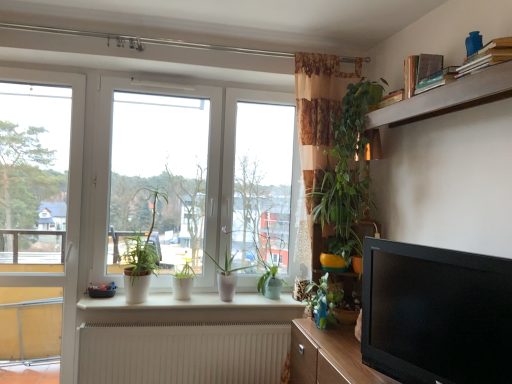
At what (x,y) coordinates should I click in order to perform the action: click on blank space situated above white plastic door at left (from a real-world perspective). Please return your answer as a coordinate pair (x, y). The width and height of the screenshot is (512, 384). Looking at the image, I should click on (42, 67).